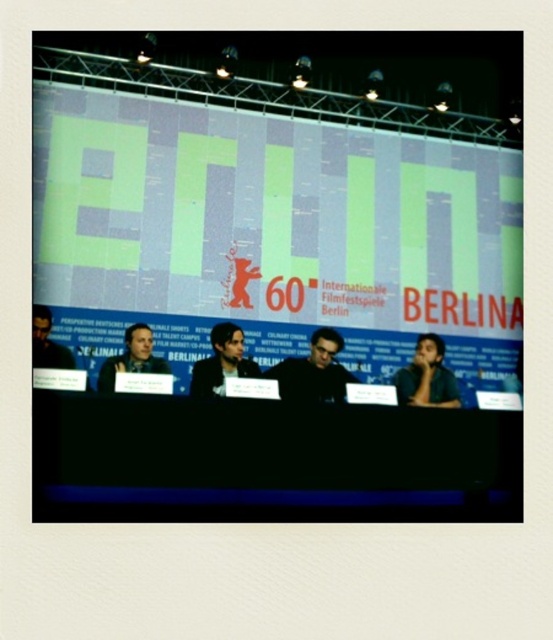
Is the position of matte black man at left more distant than that of dark hair person at left?

That is True.

Does matte black man at left appear over dark hair person at left?

No.

Is point (119, 369) positioned before point (33, 364)?

No.

Identify the location of matte black man at left. This screenshot has width=553, height=640. (132, 358).

Who is more distant from viewer, (x=326, y=397) or (x=425, y=374)?

Positioned behind is point (x=425, y=374).

Is dark gray fabric jacket at center taller than dark green shirt at right?

Indeed, dark gray fabric jacket at center has a greater height compared to dark green shirt at right.

Find the location of a particular element. This screenshot has height=640, width=553. dark gray fabric jacket at center is located at coordinates (314, 371).

Can you confirm if dark green shirt at right is wider than dark hair person at left?

Yes.

Is point (446, 381) positioned in front of point (44, 353)?

No.

Image resolution: width=553 pixels, height=640 pixels. I want to click on dark green shirt at right, so click(x=426, y=376).